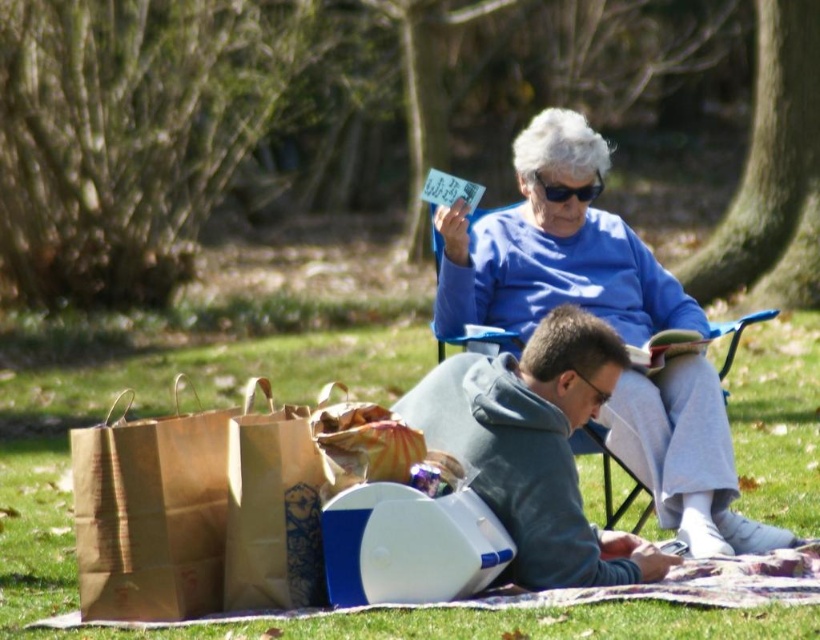
Question: Which of the following is the farthest from the observer?

Choices:
 (A) blue cotton sweater at upper center
 (B) blue fabric chair at upper center

Answer: (B)

Question: Which point is closer to the camera?

Choices:
 (A) blue fabric chair at upper center
 (B) blue cotton sweater at upper center
 (C) gray fleece hoodie at lower center
 (D) green grass at lower center

Answer: (C)

Question: Can you confirm if blue cotton sweater at upper center is positioned to the left of gray fleece hoodie at lower center?

Choices:
 (A) yes
 (B) no

Answer: (B)

Question: In this image, where is gray fleece hoodie at lower center located relative to blue fabric chair at upper center?

Choices:
 (A) left
 (B) right

Answer: (A)

Question: Which object appears farthest from the camera in this image?

Choices:
 (A) brown paper bag at lower left
 (B) blue fabric chair at upper center
 (C) gray fleece hoodie at lower center

Answer: (B)

Question: Is green grass at lower center smaller than gray fleece hoodie at lower center?

Choices:
 (A) yes
 (B) no

Answer: (A)